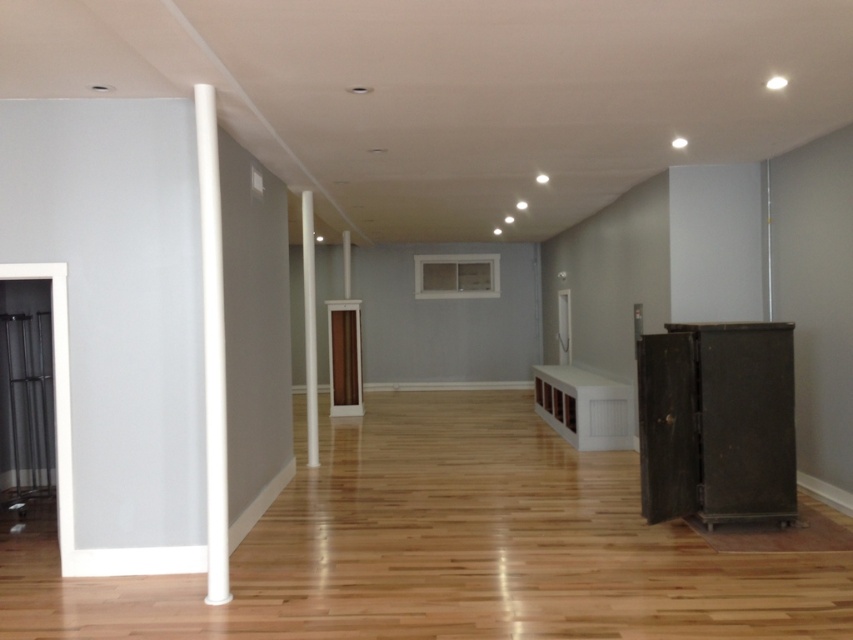
Question: Among these objects, which one is farthest from the camera?

Choices:
 (A) white smooth pole at left
 (B) white glossy pillar at center

Answer: (B)

Question: Which point is farther from the camera taking this photo?

Choices:
 (A) (223, 524)
 (B) (308, 202)

Answer: (B)

Question: Does white smooth pole at left have a larger size compared to white glossy pillar at center?

Choices:
 (A) yes
 (B) no

Answer: (A)

Question: Is white smooth pole at left thinner than white glossy pillar at center?

Choices:
 (A) no
 (B) yes

Answer: (A)

Question: Observing the image, what is the correct spatial positioning of white smooth pole at left in reference to white glossy pillar at center?

Choices:
 (A) right
 (B) left

Answer: (A)

Question: Among these points, which one is nearest to the camera?

Choices:
 (A) (310, 298)
 (B) (195, 102)

Answer: (B)